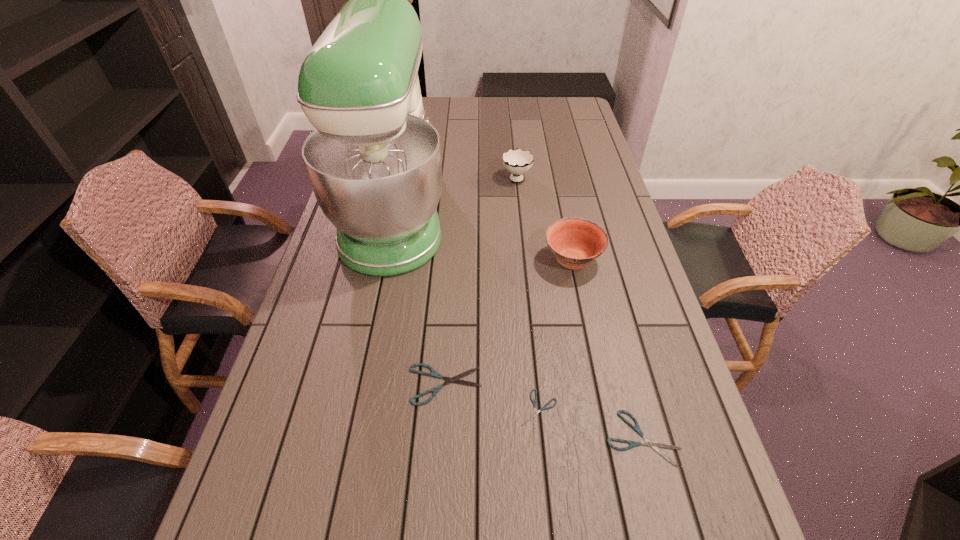
Locate an element on the screen. This screenshot has height=540, width=960. vacant space situated on the left of the second tallest shears is located at coordinates (423, 438).

The width and height of the screenshot is (960, 540). I want to click on vacant point located 0.320m on the side of the cup with the handle, so pos(511,125).

This screenshot has width=960, height=540. I want to click on blank space located 0.240m on the side of the cup with the handle, so click(x=512, y=134).

Locate an element on the screen. Image resolution: width=960 pixels, height=540 pixels. blank space located 0.090m on the side of the cup with the handle is located at coordinates (514, 153).

Locate an element on the screen. The image size is (960, 540). vacant space situated 0.070m on the controls of the tallest object is located at coordinates 470,216.

The image size is (960, 540). Find the location of `free space located on the back of the bowl`. free space located on the back of the bowl is located at coordinates (564, 217).

At what (x,y) coordinates should I click in order to perform the action: click on object present at the near edge. Please return your answer as a coordinate pair (x, y). The height and width of the screenshot is (540, 960). Looking at the image, I should click on (654, 445).

The height and width of the screenshot is (540, 960). Identify the location of object that is positioned at the left edge. [x=374, y=161].

Where is `shears that is at the right edge`? The height and width of the screenshot is (540, 960). shears that is at the right edge is located at coordinates (654, 445).

This screenshot has height=540, width=960. Find the location of `bowl that is at the right edge`. bowl that is at the right edge is located at coordinates (576, 242).